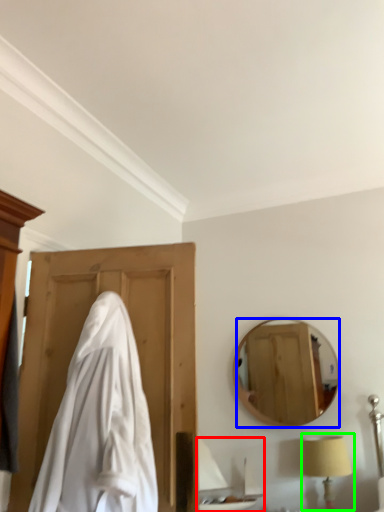
Question: Which object is positioned farthest from sink (highlighted by a red box)? Select from mirror (highlighted by a blue box) and table lamp (highlighted by a green box).

Choices:
 (A) mirror
 (B) table lamp

Answer: (A)